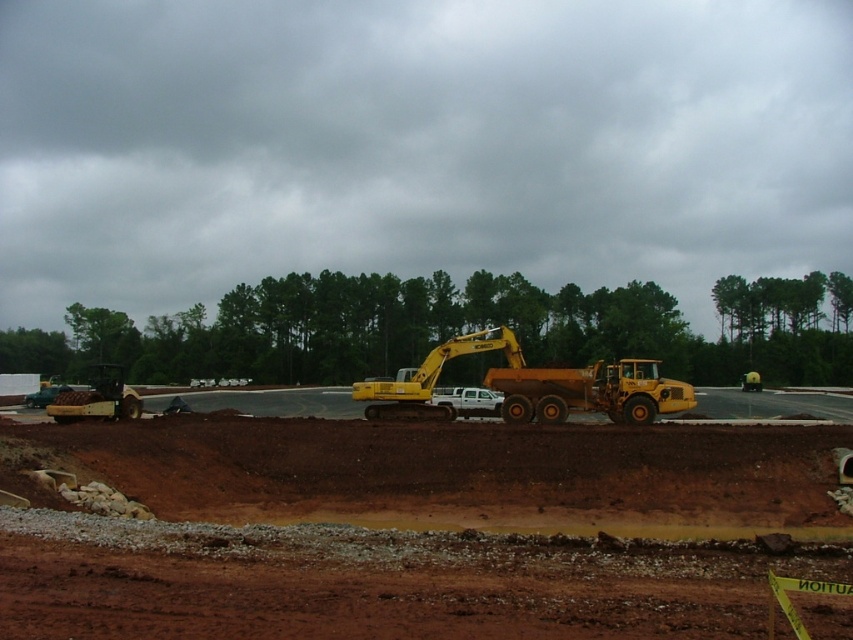
Question: Which object appears farthest from the camera in this image?

Choices:
 (A) brown soil at center
 (B) yellow metallic excavator at center

Answer: (B)

Question: Which point is closer to the camera taking this photo?

Choices:
 (A) (368, 381)
 (B) (508, 440)

Answer: (B)

Question: Can you confirm if brown soil at center is thinner than yellow metallic excavator at center?

Choices:
 (A) yes
 (B) no

Answer: (B)

Question: Does brown soil at center appear under yellow metallic excavator at center?

Choices:
 (A) no
 (B) yes

Answer: (B)

Question: Can you confirm if brown soil at center is smaller than yellow metallic excavator at center?

Choices:
 (A) no
 (B) yes

Answer: (A)

Question: Which of the following is the closest to the observer?

Choices:
 (A) (201, 600)
 (B) (469, 352)

Answer: (A)